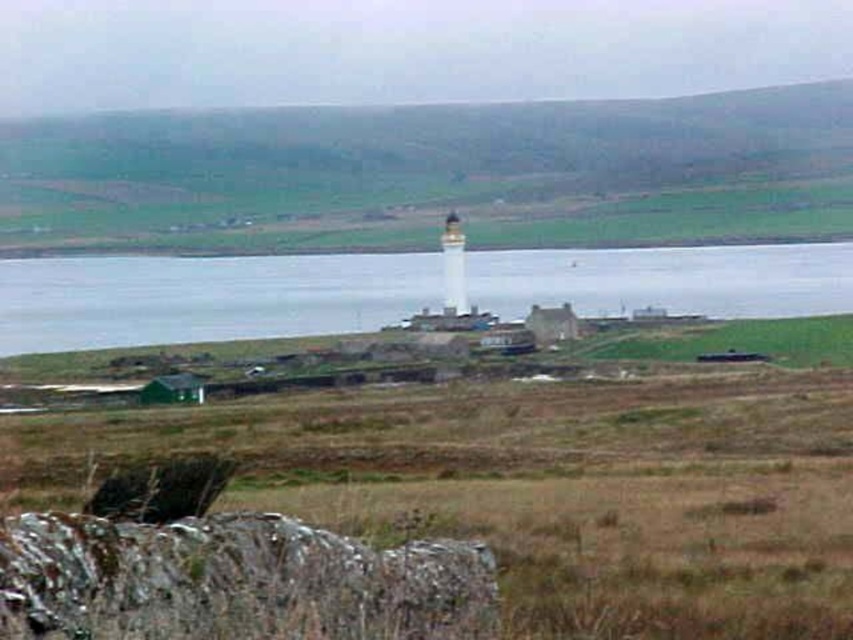
This screenshot has width=853, height=640. Identify the location of rusty metallic stone at lower left. (231, 577).

Does green grassy hillside at upper center have a larger size compared to rusty metallic stone at lower left?

Yes.

Is green grassy hillside at upper center wider than rusty metallic stone at lower left?

Indeed, green grassy hillside at upper center has a greater width compared to rusty metallic stone at lower left.

What are the coordinates of `green grassy hillside at upper center` in the screenshot? It's located at (434, 176).

Who is positioned more to the right, clear water at center or rusty metallic stone at lower left?

From the viewer's perspective, rusty metallic stone at lower left appears more on the right side.

Can you confirm if clear water at center is wider than rusty metallic stone at lower left?

Indeed, clear water at center has a greater width compared to rusty metallic stone at lower left.

Looking at this image, who is more forward, [128,273] or [418,580]?

Point [418,580] is more forward.

Where is `clear water at center`? The width and height of the screenshot is (853, 640). clear water at center is located at coordinates (204, 298).